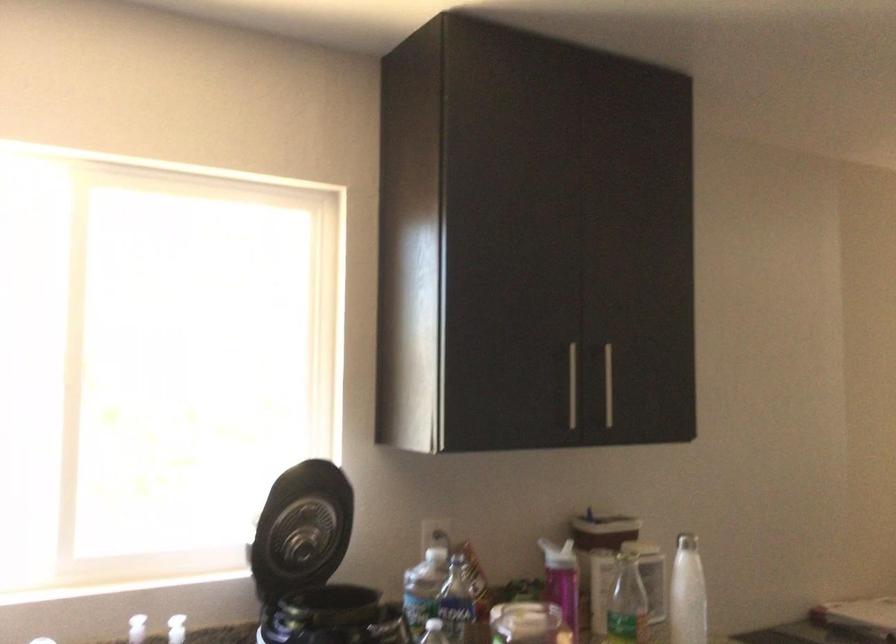
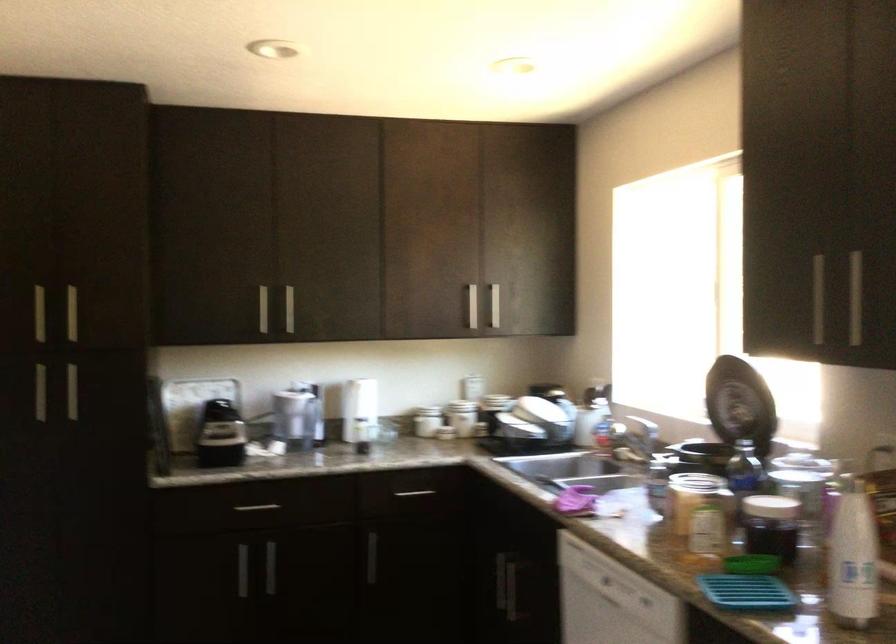
Find the pixel in the second image that matches the point at 643,564 in the first image.

(853, 556)